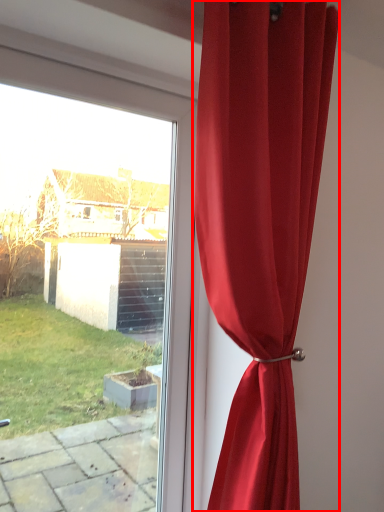
Question: Considering the relative positions of curtain (annotated by the red box) and window in the image provided, where is curtain (annotated by the red box) located with respect to the staircase?

Choices:
 (A) right
 (B) left

Answer: (A)